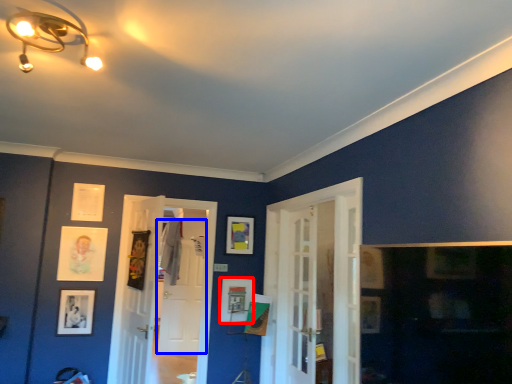
Question: Which point is closer to the camera, picture frame (highlighted by a red box) or door (highlighted by a blue box)?

Choices:
 (A) picture frame
 (B) door

Answer: (A)